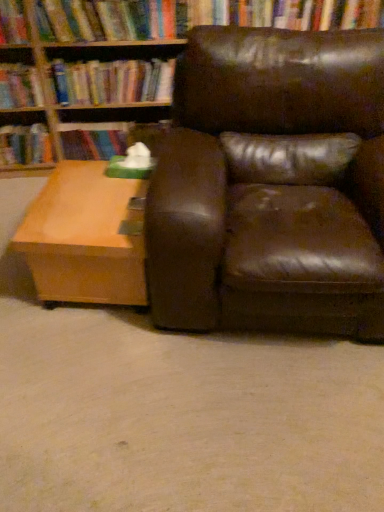
Image resolution: width=384 pixels, height=512 pixels. What are the coordinates of `light brown wood coffee table at lower left` in the screenshot? It's located at (86, 237).

This screenshot has width=384, height=512. What do you see at coordinates (86, 237) in the screenshot?
I see `light brown wood coffee table at lower left` at bounding box center [86, 237].

Where is `hardcover book at center, which appears as the 2th book when viewed from the right`? This screenshot has height=512, width=384. hardcover book at center, which appears as the 2th book when viewed from the right is located at coordinates tap(109, 139).

What do you see at coordinates (109, 139) in the screenshot?
I see `hardcover book at center, the 3th book when ordered from left to right` at bounding box center [109, 139].

Measure the distance between point [90,72] and camera.

The distance of point [90,72] from camera is 7.30 feet.

Describe the element at coordinates (19, 87) in the screenshot. I see `hardcover book at upper left, which is the second book in left-to-right order` at that location.

This screenshot has width=384, height=512. In order to click on brown leather chair at center in this screenshot , I will do `click(271, 185)`.

I want to click on light brown wood coffee table at lower left, so click(x=86, y=237).

From a real-world perspective, which object rests below the other?

light brown wood coffee table at lower left, from a real-world perspective.

The height and width of the screenshot is (512, 384). Find the location of `table in front of the hardcover book at left, which ranks as the 1th book in left-to-right order`. table in front of the hardcover book at left, which ranks as the 1th book in left-to-right order is located at coordinates (86, 237).

Can you confirm if hardcover book at left, arranged as the 4th book when viewed from the right, is thinner than light brown wood coffee table at lower left?

Indeed, hardcover book at left, arranged as the 4th book when viewed from the right, has a lesser width compared to light brown wood coffee table at lower left.

Considering the relative sizes of hardcover book at left, arranged as the 4th book when viewed from the right, and light brown wood coffee table at lower left in the image provided, is hardcover book at left, arranged as the 4th book when viewed from the right, taller than light brown wood coffee table at lower left?

No.

Is hardcover book at left, arranged as the 4th book when viewed from the right, shorter than hardcover book at upper left, which is the second book in left-to-right order?

Yes.

Which object is positioned more to the left, hardcover book at left, arranged as the 4th book when viewed from the right, or hardcover book at upper left, which is the 3th book from right to left?

hardcover book at left, arranged as the 4th book when viewed from the right.

Does hardcover book at left, arranged as the 4th book when viewed from the right, lie in front of hardcover book at upper left, which is the second book in left-to-right order?

No, hardcover book at left, arranged as the 4th book when viewed from the right, is behind hardcover book at upper left, which is the second book in left-to-right order.

In the scene shown: Can you confirm if hardcover book at left, arranged as the 4th book when viewed from the right, is smaller than hardcover book at upper left, which is the second book in left-to-right order?

Incorrect, hardcover book at left, arranged as the 4th book when viewed from the right, is not smaller in size than hardcover book at upper left, which is the second book in left-to-right order.

From a real-world perspective, count 1st books upward from the hardcover book at left, arranged as the 4th book when viewed from the right, and point to it. Please provide its 2D coordinates.

[(112, 82)]

From a real-world perspective, is hardcover book at upper center, which ranks as the 4th book in left-to-right order, physically above hardcover book at left, arranged as the 4th book when viewed from the right?

Correct, in the physical world, hardcover book at upper center, which ranks as the 4th book in left-to-right order, is higher than hardcover book at left, arranged as the 4th book when viewed from the right.

Looking at the image, does hardcover book at upper center, which is the first book in right-to-left order, seem bigger or smaller compared to hardcover book at left, arranged as the 4th book when viewed from the right?

Clearly, hardcover book at upper center, which is the first book in right-to-left order, is larger in size than hardcover book at left, arranged as the 4th book when viewed from the right.

Considering the relative positions of hardcover book at upper center, which ranks as the 4th book in left-to-right order, and hardcover book at left, arranged as the 4th book when viewed from the right, in the image provided, is hardcover book at upper center, which ranks as the 4th book in left-to-right order, behind hardcover book at left, arranged as the 4th book when viewed from the right,?

No, hardcover book at upper center, which ranks as the 4th book in left-to-right order, is in front of hardcover book at left, arranged as the 4th book when viewed from the right.

From the brown leather chair at center, count the 4th book to the left and point to it. Please provide its 2D coordinates.

[(25, 145)]

Considering the relative sizes of hardcover book at left, which ranks as the 1th book in left-to-right order, and brown leather chair at center in the image provided, is hardcover book at left, which ranks as the 1th book in left-to-right order, smaller than brown leather chair at center?

Yes, hardcover book at left, which ranks as the 1th book in left-to-right order, is smaller than brown leather chair at center.

Does hardcover book at left, arranged as the 4th book when viewed from the right, appear on the left side of brown leather chair at center?

Indeed, hardcover book at left, arranged as the 4th book when viewed from the right, is positioned on the left side of brown leather chair at center.

Considering the relative sizes of hardcover book at left, arranged as the 4th book when viewed from the right, and brown leather chair at center in the image provided, is hardcover book at left, arranged as the 4th book when viewed from the right, wider than brown leather chair at center?

In fact, hardcover book at left, arranged as the 4th book when viewed from the right, might be narrower than brown leather chair at center.

Image resolution: width=384 pixels, height=512 pixels. I want to click on the 3rd book above the light brown wood coffee table at lower left (from the image's perspective), so click(19, 87).

Can we say light brown wood coffee table at lower left lies outside hardcover book at upper left, which is the second book in left-to-right order?

light brown wood coffee table at lower left is positioned outside hardcover book at upper left, which is the second book in left-to-right order.

Looking at this image, are light brown wood coffee table at lower left and hardcover book at upper left, which is the 3th book from right to left, located far from each other?

No, light brown wood coffee table at lower left is not far from hardcover book at upper left, which is the 3th book from right to left.

Does light brown wood coffee table at lower left appear on the left side of hardcover book at upper left, which is the second book in left-to-right order?

No, light brown wood coffee table at lower left is not to the left of hardcover book at upper left, which is the second book in left-to-right order.

Considering the relative positions of light brown wood coffee table at lower left and hardcover book at left, which ranks as the 1th book in left-to-right order, in the image provided, is light brown wood coffee table at lower left in front of hardcover book at left, which ranks as the 1th book in left-to-right order,?

Yes, the depth of light brown wood coffee table at lower left is less than that of hardcover book at left, which ranks as the 1th book in left-to-right order.

Which of these two, light brown wood coffee table at lower left or hardcover book at left, which ranks as the 1th book in left-to-right order, is wider?

light brown wood coffee table at lower left is wider.

From a real-world perspective, which object stands above the other?

hardcover book at left, which ranks as the 1th book in left-to-right order.

Considering the points (103, 243) and (33, 136), which point is behind, point (103, 243) or point (33, 136)?

The point (33, 136) is farther.

Does light brown wood coffee table at lower left turn towards hardcover book at center, which appears as the 2th book when viewed from the right?

No, light brown wood coffee table at lower left is not facing towards hardcover book at center, which appears as the 2th book when viewed from the right.

Between light brown wood coffee table at lower left and hardcover book at center, which appears as the 2th book when viewed from the right, which one has larger size?

light brown wood coffee table at lower left is bigger.

From their relative heights in the image, would you say light brown wood coffee table at lower left is taller or shorter than hardcover book at center, which appears as the 2th book when viewed from the right?

In the image, light brown wood coffee table at lower left appears to be taller than hardcover book at center, which appears as the 2th book when viewed from the right.

Which is in front, light brown wood coffee table at lower left or hardcover book at center, which appears as the 2th book when viewed from the right?

light brown wood coffee table at lower left is in front.

You are a GUI agent. You are given a task and a screenshot of the screen. Output one action in this format:
    pyautogui.click(x=<x>, y=<y>)
    Task: Click on the table in front of the hardcover book at left, arranged as the 4th book when viewed from the right
    Image resolution: width=384 pixels, height=512 pixels.
    Given the screenshot: What is the action you would take?
    pyautogui.click(x=86, y=237)

Starting from the hardcover book at left, which ranks as the 1th book in left-to-right order, which book is the 1st one to the right? Please provide its 2D coordinates.

[(19, 87)]

Looking at this image, when comparing their distances from hardcover book at upper left, which is the second book in left-to-right order, does brown leather chair at center or hardcover book at center, the 3th book when ordered from left to right, seem further?

Among the two, brown leather chair at center is located further to hardcover book at upper left, which is the second book in left-to-right order.

Based on their spatial positions, is brown leather chair at center or hardcover book at left, arranged as the 4th book when viewed from the right, closer to hardcover book at center, which appears as the 2th book when viewed from the right?

hardcover book at left, arranged as the 4th book when viewed from the right, is closer to hardcover book at center, which appears as the 2th book when viewed from the right.

Estimate the real-world distances between objects in this image. Which object is closer to hardcover book at left, arranged as the 4th book when viewed from the right, hardcover book at upper left, which is the second book in left-to-right order, or hardcover book at center, which appears as the 2th book when viewed from the right?

hardcover book at upper left, which is the second book in left-to-right order, lies closer to hardcover book at left, arranged as the 4th book when viewed from the right, than the other object.

Based on their spatial positions, is hardcover book at left, arranged as the 4th book when viewed from the right, or brown leather chair at center further from light brown wood coffee table at lower left?

hardcover book at left, arranged as the 4th book when viewed from the right, is further to light brown wood coffee table at lower left.

Considering their positions, is hardcover book at center, which appears as the 2th book when viewed from the right, positioned further to hardcover book at upper left, which is the 3th book from right to left, than hardcover book at upper center, which ranks as the 4th book in left-to-right order?

Based on the image, hardcover book at center, which appears as the 2th book when viewed from the right, appears to be further to hardcover book at upper left, which is the 3th book from right to left.

Looking at this image, based on their spatial positions, is light brown wood coffee table at lower left or hardcover book at left, which ranks as the 1th book in left-to-right order, further from brown leather chair at center?

Based on the image, hardcover book at left, which ranks as the 1th book in left-to-right order, appears to be further to brown leather chair at center.

Looking at the image, which one is located further to hardcover book at upper left, which is the 3th book from right to left, hardcover book at upper center, which is the first book in right-to-left order, or light brown wood coffee table at lower left?

light brown wood coffee table at lower left is further to hardcover book at upper left, which is the 3th book from right to left.

Estimate the real-world distances between objects in this image. Which object is further from hardcover book at upper left, which is the 3th book from right to left, hardcover book at center, the 3th book when ordered from left to right, or brown leather chair at center?

Among the two, brown leather chair at center is located further to hardcover book at upper left, which is the 3th book from right to left.

I want to click on table located between hardcover book at left, which ranks as the 1th book in left-to-right order, and brown leather chair at center in the left-right direction, so click(x=86, y=237).

Locate an element on the screen. This screenshot has height=512, width=384. table between brown leather chair at center and hardcover book at upper center, which ranks as the 4th book in left-to-right order, from front to back is located at coordinates (86, 237).

What are the coordinates of `book situated between hardcover book at upper left, which is the 3th book from right to left, and hardcover book at upper center, which ranks as the 4th book in left-to-right order, from left to right` in the screenshot? It's located at (109, 139).

In order to click on book between hardcover book at left, which ranks as the 1th book in left-to-right order, and hardcover book at center, which appears as the 2th book when viewed from the right, from left to right in this screenshot , I will do `click(19, 87)`.